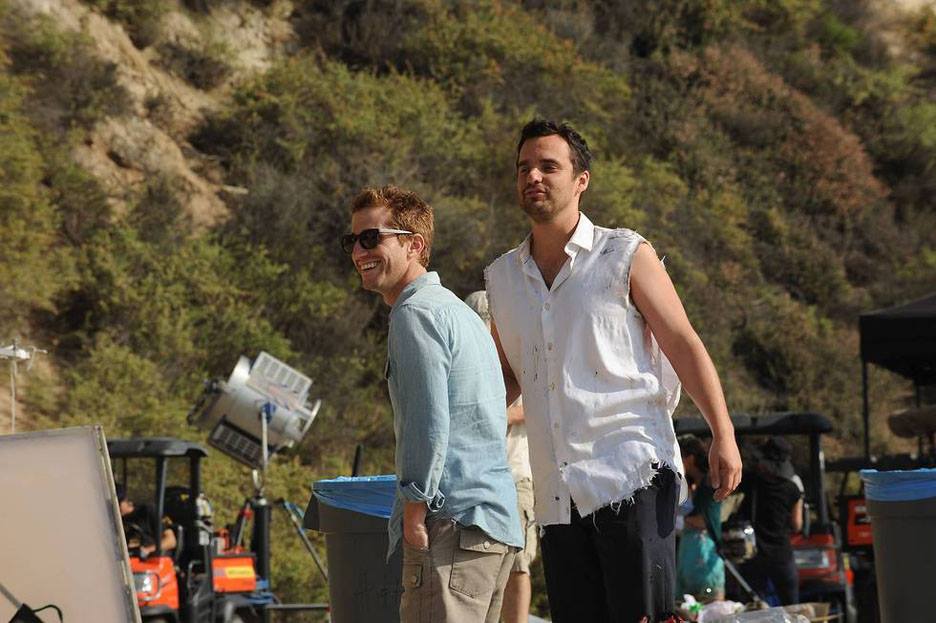
You are a GUI agent. You are given a task and a screenshot of the screen. Output one action in this format:
    pyautogui.click(x=<x>, y=<y>)
    Task: Click on the trash bags
    Image resolution: width=936 pixels, height=623 pixels.
    Given the screenshot: What is the action you would take?
    pyautogui.click(x=899, y=480), pyautogui.click(x=358, y=487)